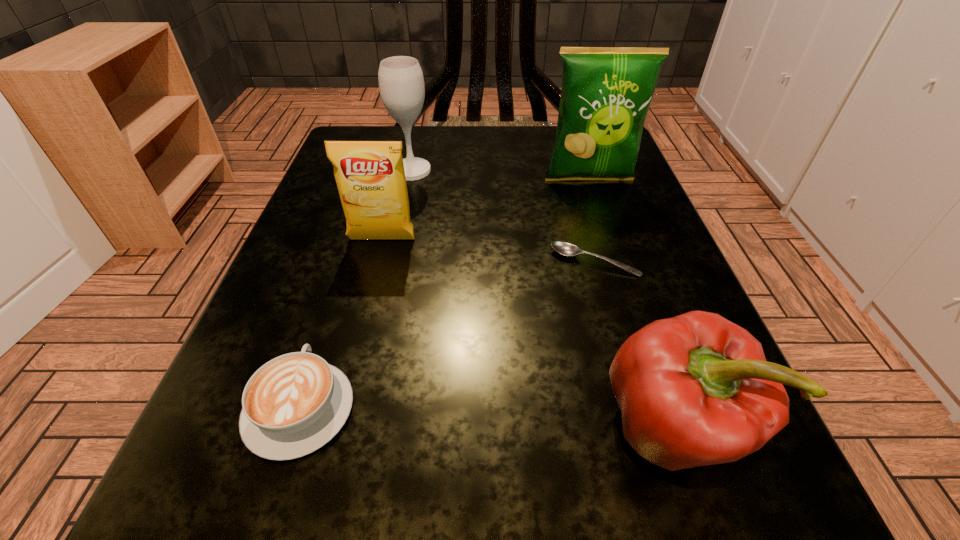
The width and height of the screenshot is (960, 540). Identify the location of blank area at the left edge. (285, 465).

In the image, there is a desktop. Where is `vacant region at the right edge`? The image size is (960, 540). vacant region at the right edge is located at coordinates (575, 227).

In the image, there is a desktop. At what (x,y) coordinates should I click in order to perform the action: click on vacant space at the far right corner. Please return your answer as a coordinate pair (x, y). Looking at the image, I should click on point(550,144).

The height and width of the screenshot is (540, 960). Find the location of `vacant space at the near right corner`. vacant space at the near right corner is located at coordinates (715, 524).

The height and width of the screenshot is (540, 960). Identify the location of vacant area that lies between the farther crisp (potato chip) and the shortest object. (592, 221).

Identify the location of empty location between the soupspoon and the nearer crisp (potato chip). (489, 251).

Locate an element on the screen. The width and height of the screenshot is (960, 540). vacant area that lies between the shorter crisp (potato chip) and the bell pepper is located at coordinates (526, 333).

Identify the location of vacant region between the second tallest object and the fifth tallest object. Image resolution: width=960 pixels, height=540 pixels. (356, 289).

Where is `vacant space that is in between the fifth shortest object and the taller crisp (potato chip)`? This screenshot has height=540, width=960. vacant space that is in between the fifth shortest object and the taller crisp (potato chip) is located at coordinates (500, 176).

Image resolution: width=960 pixels, height=540 pixels. Identify the location of free space between the bell pepper and the cappuccino. (486, 417).